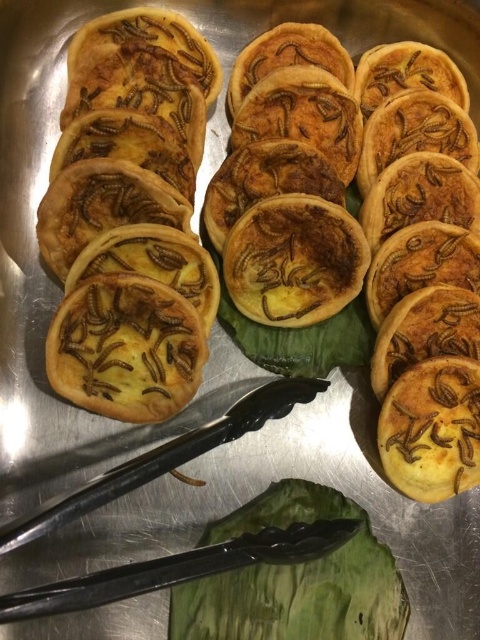
Question: Among these points, which one is farthest from the camera?

Choices:
 (A) (393, 396)
 (B) (78, 346)
 (C) (261, 515)

Answer: (A)

Question: Estimate the real-world distances between objects in this image. Which object is closer to the golden crispy pastry at right?

Choices:
 (A) golden-brown crispy pastry at left
 (B) green leafy vegetable at lower center

Answer: (B)

Question: Is brown matte cookie at center wider than golden crispy pastry at right?

Choices:
 (A) no
 (B) yes

Answer: (B)

Question: Which is farther from the green leafy vegetable at lower center?

Choices:
 (A) golden-brown crispy pastry at left
 (B) brown matte cookie at center
 (C) golden crispy pastry at right

Answer: (A)

Question: Does golden-brown crispy pastry at left have a larger size compared to brown matte cookie at center?

Choices:
 (A) yes
 (B) no

Answer: (A)

Question: Does golden-brown crispy pastry at left have a greater width compared to golden crispy pastry at right?

Choices:
 (A) yes
 (B) no

Answer: (A)